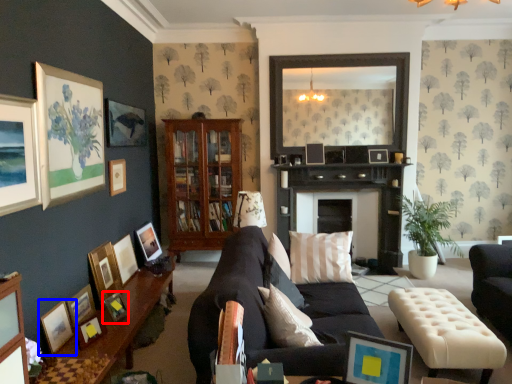
Question: Among these objects, which one is farthest to the camera, picture frame (highlighted by a red box) or picture frame (highlighted by a blue box)?

Choices:
 (A) picture frame
 (B) picture frame

Answer: (A)